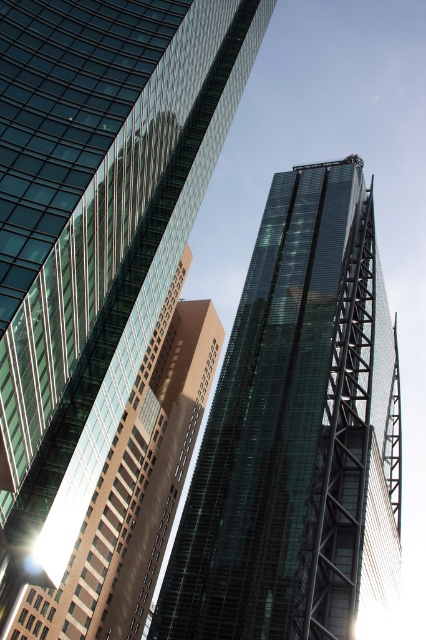
Question: Does transparent glass skyscraper at center lie in front of green glass tower at center?

Choices:
 (A) no
 (B) yes

Answer: (B)

Question: Is transparent glass skyscraper at center wider than green glass tower at center?

Choices:
 (A) no
 (B) yes

Answer: (A)

Question: Which point appears closest to the camera in this image?

Choices:
 (A) (210, 435)
 (B) (134, 240)

Answer: (B)

Question: Where is transparent glass skyscraper at center located in relation to green glass tower at center in the image?

Choices:
 (A) left
 (B) right

Answer: (A)